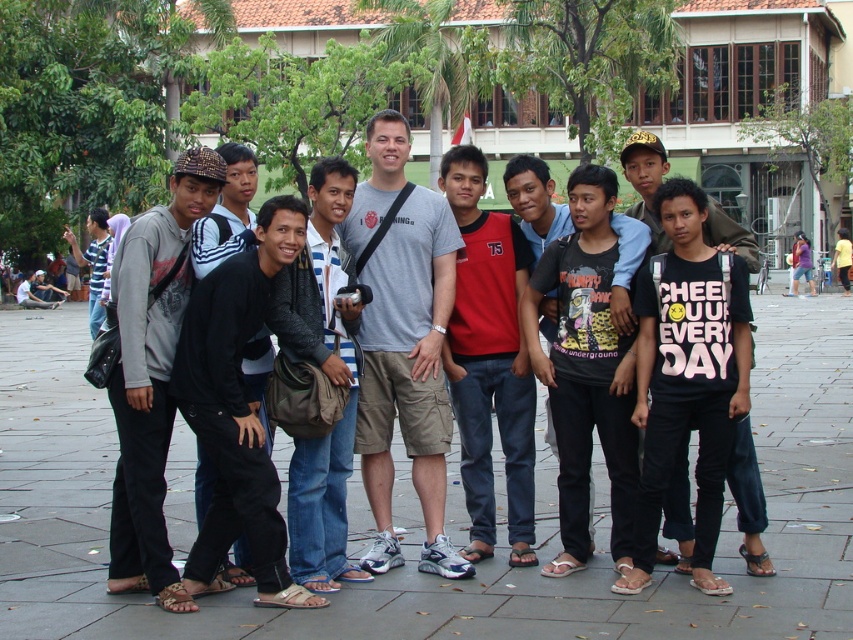
Consider the image. Does matte gray hoodie at left have a smaller size compared to black cotton t-shirt at center?

Yes.

In the scene shown: Does matte gray hoodie at left have a greater height compared to black cotton t-shirt at center?

No.

Where is `matte gray hoodie at left`? This screenshot has width=853, height=640. matte gray hoodie at left is located at coordinates (152, 376).

The image size is (853, 640). Find the location of `matte gray hoodie at left`. matte gray hoodie at left is located at coordinates (152, 376).

Is point (405, 208) less distant than point (225, 250)?

No, it is behind (225, 250).

Which is behind, point (386, 548) or point (222, 150)?

The point (222, 150) is more distant.

At what (x,y) coordinates should I click in order to perform the action: click on gray cotton t-shirt at center. Please return your answer as a coordinate pair (x, y). This screenshot has width=853, height=640. Looking at the image, I should click on (403, 342).

Measure the distance from matte gray hoodie at left to leather jacket at center.

The distance of matte gray hoodie at left from leather jacket at center is 36.71 inches.

Which is more to the left, matte gray hoodie at left or leather jacket at center?

matte gray hoodie at left is more to the left.

Is point (149, 390) positioned before point (297, 460)?

That is True.

Find the location of a particular element. matte gray hoodie at left is located at coordinates (152, 376).